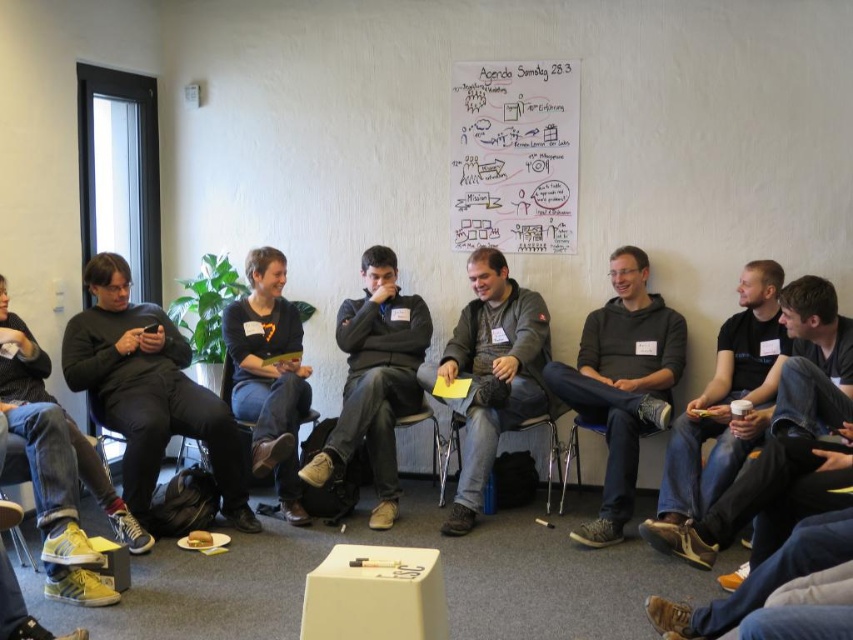
Does point (550, 385) lie in front of point (767, 401)?

That is False.

Is point (633, 339) behind point (718, 422)?

Yes, it is.

This screenshot has width=853, height=640. I want to click on dark gray hoodie at center, so [x=622, y=381].

How far apart are dark gray hoodie at center and gray fabric jacket at center?

46.93 centimeters

Between point (604, 477) and point (480, 468), which one is positioned behind?

Point (604, 477)

Where is `dark gray hoodie at center`? dark gray hoodie at center is located at coordinates (622, 381).

Which is in front, point (38, 365) or point (283, 349)?

Point (38, 365) is more forward.

What are the coordinates of `yellow leather sneakers at lower left` in the screenshot? It's located at (57, 468).

At what (x,y) coordinates should I click in order to perform the action: click on yellow leather sneakers at lower left. Please return your answer as a coordinate pair (x, y). The image size is (853, 640). Looking at the image, I should click on (57, 468).